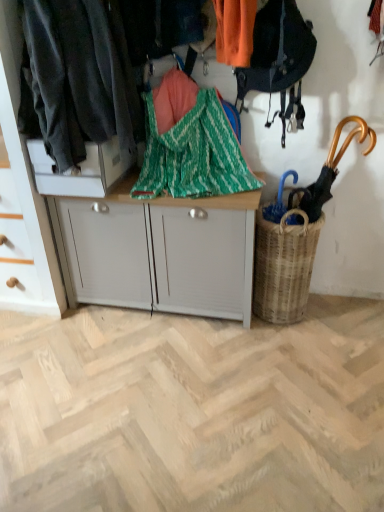
Question: From a real-world perspective, is wooden umbrella at right below dark gray fabric at left?

Choices:
 (A) yes
 (B) no

Answer: (A)

Question: Considering the relative sizes of wooden umbrella at right and dark gray fabric at left in the image provided, is wooden umbrella at right shorter than dark gray fabric at left?

Choices:
 (A) no
 (B) yes

Answer: (B)

Question: Is dark gray fabric at left at the back of wooden umbrella at right?

Choices:
 (A) no
 (B) yes

Answer: (A)

Question: Considering the relative sizes of wooden umbrella at right and dark gray fabric at left in the image provided, is wooden umbrella at right thinner than dark gray fabric at left?

Choices:
 (A) no
 (B) yes

Answer: (B)

Question: Is wooden umbrella at right with dark gray fabric at left?

Choices:
 (A) no
 (B) yes

Answer: (A)

Question: Is wooden umbrella at right wider than dark gray fabric at left?

Choices:
 (A) yes
 (B) no

Answer: (B)

Question: From a real-world perspective, is green zigzag fabric at center positioned over white matte cabinet at left, which is the first cabinetry from left to right, based on gravity?

Choices:
 (A) no
 (B) yes

Answer: (B)

Question: Is green zigzag fabric at center at the right side of white matte cabinet at left, which is the first cabinetry from left to right?

Choices:
 (A) yes
 (B) no

Answer: (A)

Question: Does green zigzag fabric at center appear on the left side of white matte cabinet at left, which is the first cabinetry from left to right?

Choices:
 (A) yes
 (B) no

Answer: (B)

Question: Would you say green zigzag fabric at center contains white matte cabinet at left, which is the first cabinetry from left to right?

Choices:
 (A) no
 (B) yes

Answer: (A)

Question: Does green zigzag fabric at center have a larger size compared to white matte cabinet at left, which is counted as the second cabinetry, starting from the right?

Choices:
 (A) no
 (B) yes

Answer: (A)

Question: Does green zigzag fabric at center lie behind white matte cabinet at left, which is the first cabinetry from left to right?

Choices:
 (A) yes
 (B) no

Answer: (B)

Question: Can you confirm if woven brown basket at lower right is shorter than wooden umbrella at right?

Choices:
 (A) yes
 (B) no

Answer: (B)